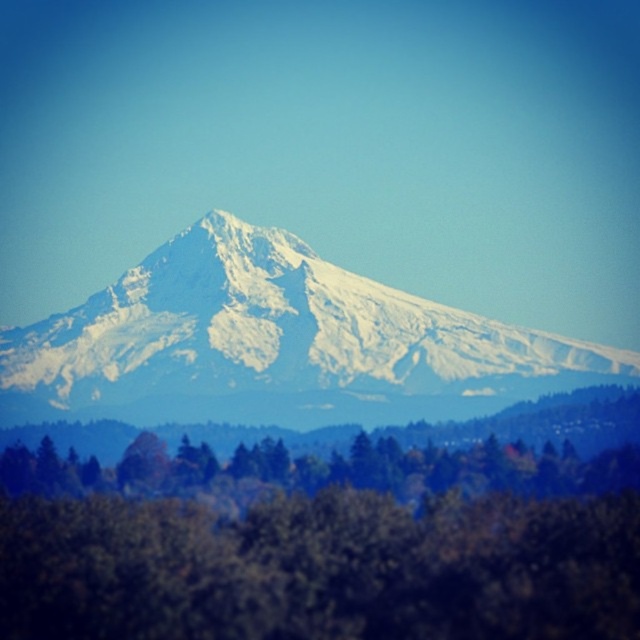
Which is more to the left, green matte tree at center or white snow-covered mountain at center?

Positioned to the left is green matte tree at center.

Can you confirm if green matte tree at center is bigger than white snow-covered mountain at center?

No.

The width and height of the screenshot is (640, 640). What do you see at coordinates (323, 547) in the screenshot? I see `green matte tree at center` at bounding box center [323, 547].

Identify the location of green matte tree at center. (323, 547).